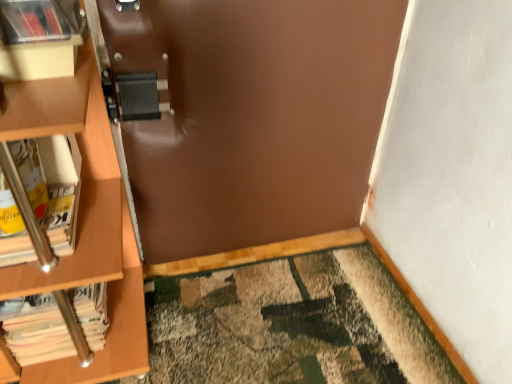
Find the location of a particular element. white paper book at left, the 2th book in the bottom-to-top sequence is located at coordinates point(52,185).

Find the location of `shelf lying on the right of white paper book at left, the 2th book in the bottom-to-top sequence`. shelf lying on the right of white paper book at left, the 2th book in the bottom-to-top sequence is located at coordinates (40, 38).

Based on the photo, in the image, is matte plastic shelf at upper left positioned in front of or behind white paper book at left, the 2th book in the bottom-to-top sequence?

Visually, matte plastic shelf at upper left is located in front of white paper book at left, the 2th book in the bottom-to-top sequence.

From a real-world perspective, which object rests below the other?

white paper book at left, the 2th book in the bottom-to-top sequence, is physically lower.

Would you say matte plastic shelf at upper left is to the left or to the right of white paper book at left, the 2th book in the bottom-to-top sequence, in the picture?

matte plastic shelf at upper left is to the right of white paper book at left, the 2th book in the bottom-to-top sequence.

From the picture: Can we say matte plastic shelf at upper left lies outside matte plastic book at upper left, the 3th book when ordered from bottom to top?

Yes, matte plastic shelf at upper left is located beyond the bounds of matte plastic book at upper left, the 3th book when ordered from bottom to top.

Based on the photo, considering the positions of objects matte plastic shelf at upper left and matte plastic book at upper left, which ranks as the 1th book in top-to-bottom order, in the image provided, who is more to the left, matte plastic shelf at upper left or matte plastic book at upper left, which ranks as the 1th book in top-to-bottom order,?

Positioned to the left is matte plastic shelf at upper left.

From a real-world perspective, is matte plastic shelf at upper left above or below matte plastic book at upper left, the 3th book when ordered from bottom to top?

matte plastic shelf at upper left is below matte plastic book at upper left, the 3th book when ordered from bottom to top.

How much distance is there between matte plastic shelf at upper left and matte plastic book at upper left, which ranks as the 1th book in top-to-bottom order?

A distance of 0.64 inches exists between matte plastic shelf at upper left and matte plastic book at upper left, which ranks as the 1th book in top-to-bottom order.

From the image's perspective, which is above, white paper book at left, the 3th book in the top-to-bottom sequence, or matte plastic book at upper left, which ranks as the 1th book in top-to-bottom order?

matte plastic book at upper left, which ranks as the 1th book in top-to-bottom order.

Considering the relative sizes of white paper book at left, the 3th book in the top-to-bottom sequence, and matte plastic book at upper left, which ranks as the 1th book in top-to-bottom order, in the image provided, is white paper book at left, the 3th book in the top-to-bottom sequence, bigger than matte plastic book at upper left, which ranks as the 1th book in top-to-bottom order,?

Yes, white paper book at left, the 3th book in the top-to-bottom sequence, is bigger than matte plastic book at upper left, which ranks as the 1th book in top-to-bottom order.

Is white paper book at left, the 3th book in the top-to-bottom sequence, positioned far away from matte plastic book at upper left, the 3th book when ordered from bottom to top?

No, there isn't a large distance between white paper book at left, the 3th book in the top-to-bottom sequence, and matte plastic book at upper left, the 3th book when ordered from bottom to top.

Is matte plastic book at upper left, the 3th book when ordered from bottom to top, to the left of white paper book at left, the 2th book in the bottom-to-top sequence, from the viewer's perspective?

No, matte plastic book at upper left, the 3th book when ordered from bottom to top, is not to the left of white paper book at left, the 2th book in the bottom-to-top sequence.

Which of these two, matte plastic book at upper left, the 3th book when ordered from bottom to top, or white paper book at left, the 2th book in the top-to-bottom sequence, stands taller?

white paper book at left, the 2th book in the top-to-bottom sequence.

Considering the positions of points (48, 20) and (35, 175), is point (48, 20) farther from camera compared to point (35, 175)?

No.

From the image's perspective, between matte plastic book at upper left, the 3th book when ordered from bottom to top, and white paper book at left, the 2th book in the bottom-to-top sequence, who is located below?

From the image's view, white paper book at left, the 2th book in the bottom-to-top sequence, is below.

Locate an element on the screen. The height and width of the screenshot is (384, 512). the 2nd book behind when counting from the matte plastic book at upper left, which ranks as the 1th book in top-to-bottom order is located at coordinates (35, 329).

Can you confirm if matte plastic book at upper left, the 3th book when ordered from bottom to top, is shorter than white paper book at left, placed as the 1th book when sorted from bottom to top?

Indeed, matte plastic book at upper left, the 3th book when ordered from bottom to top, has a lesser height compared to white paper book at left, placed as the 1th book when sorted from bottom to top.

Which object is closer to the camera, matte plastic book at upper left, the 3th book when ordered from bottom to top, or white paper book at left, the 3th book in the top-to-bottom sequence?

matte plastic book at upper left, the 3th book when ordered from bottom to top, is closer to the camera.

Which of these two, white paper book at left, the 3th book in the top-to-bottom sequence, or white paper book at left, the 2th book in the bottom-to-top sequence, stands shorter?

With less height is white paper book at left, the 2th book in the bottom-to-top sequence.

Locate an element on the screen. the 1st book in front of the white paper book at left, the 3th book in the top-to-bottom sequence is located at coordinates (52, 185).

In the image, is white paper book at left, the 3th book in the top-to-bottom sequence, positioned in front of or behind white paper book at left, the 2th book in the top-to-bottom sequence?

Visually, white paper book at left, the 3th book in the top-to-bottom sequence, is located behind white paper book at left, the 2th book in the top-to-bottom sequence.

Between white paper book at left, the 3th book in the top-to-bottom sequence, and white paper book at left, the 2th book in the bottom-to-top sequence, which one has smaller width?

white paper book at left, the 3th book in the top-to-bottom sequence.

Is matte plastic book at upper left, which ranks as the 1th book in top-to-bottom order, with matte plastic shelf at upper left?

Yes, matte plastic book at upper left, which ranks as the 1th book in top-to-bottom order, is with matte plastic shelf at upper left.

Which object is further away from the camera taking this photo, matte plastic book at upper left, which ranks as the 1th book in top-to-bottom order, or matte plastic shelf at upper left?

matte plastic shelf at upper left is further away from the camera.

Could you tell me if matte plastic book at upper left, which ranks as the 1th book in top-to-bottom order, is facing matte plastic shelf at upper left?

No, matte plastic book at upper left, which ranks as the 1th book in top-to-bottom order, does not turn towards matte plastic shelf at upper left.

From the image's perspective, which one is positioned lower, matte plastic book at upper left, the 3th book when ordered from bottom to top, or matte plastic shelf at upper left?

matte plastic shelf at upper left, from the image's perspective.

From a real-world perspective, which book is the 1st one underneath the matte plastic shelf at upper left? Please provide its 2D coordinates.

[(52, 185)]

Identify the location of book that is on the right side of matte plastic shelf at upper left. (36, 21).

Consider the image. From the image, which object appears to be farther from white paper book at left, the 3th book in the top-to-bottom sequence, matte plastic book at upper left, the 3th book when ordered from bottom to top, or white paper book at left, the 2th book in the bottom-to-top sequence?

Based on the image, matte plastic book at upper left, the 3th book when ordered from bottom to top, appears to be further to white paper book at left, the 3th book in the top-to-bottom sequence.

Estimate the real-world distances between objects in this image. Which object is closer to matte plastic book at upper left, which ranks as the 1th book in top-to-bottom order, matte plastic shelf at upper left or white paper book at left, placed as the 1th book when sorted from bottom to top?

matte plastic shelf at upper left is positioned closer to the anchor matte plastic book at upper left, which ranks as the 1th book in top-to-bottom order.

From the image, which object appears to be farther from white paper book at left, the 2th book in the bottom-to-top sequence, matte plastic shelf at upper left or matte plastic book at upper left, which ranks as the 1th book in top-to-bottom order?

matte plastic book at upper left, which ranks as the 1th book in top-to-bottom order, is positioned further to the anchor white paper book at left, the 2th book in the bottom-to-top sequence.

From the image, which object appears to be farther from white paper book at left, the 2th book in the top-to-bottom sequence, white paper book at left, the 3th book in the top-to-bottom sequence, or matte plastic shelf at upper left?

Among the two, white paper book at left, the 3th book in the top-to-bottom sequence, is located further to white paper book at left, the 2th book in the top-to-bottom sequence.

Based on their spatial positions, is white paper book at left, the 2th book in the top-to-bottom sequence, or white paper book at left, placed as the 1th book when sorted from bottom to top, further from matte plastic shelf at upper left?

white paper book at left, placed as the 1th book when sorted from bottom to top.

Based on their spatial positions, is matte plastic shelf at upper left or white paper book at left, the 2th book in the top-to-bottom sequence, further from white paper book at left, the 3th book in the top-to-bottom sequence?

Based on the image, matte plastic shelf at upper left appears to be further to white paper book at left, the 3th book in the top-to-bottom sequence.

Looking at this image, when comparing their distances from white paper book at left, the 2th book in the top-to-bottom sequence, does matte plastic book at upper left, the 3th book when ordered from bottom to top, or white paper book at left, the 3th book in the top-to-bottom sequence, seem further?

The object further to white paper book at left, the 2th book in the top-to-bottom sequence, is matte plastic book at upper left, the 3th book when ordered from bottom to top.

Looking at the image, which one is located further to matte plastic shelf at upper left, white paper book at left, the 3th book in the top-to-bottom sequence, or matte plastic book at upper left, the 3th book when ordered from bottom to top?

white paper book at left, the 3th book in the top-to-bottom sequence.

Locate an element on the screen. This screenshot has width=512, height=384. shelf between matte plastic book at upper left, which ranks as the 1th book in top-to-bottom order, and white paper book at left, the 3th book in the top-to-bottom sequence, in the vertical direction is located at coordinates (40, 38).

This screenshot has height=384, width=512. In order to click on shelf between matte plastic book at upper left, which ranks as the 1th book in top-to-bottom order, and white paper book at left, the 2th book in the bottom-to-top sequence, vertically in this screenshot , I will do `click(40, 38)`.

The height and width of the screenshot is (384, 512). What are the coordinates of `book between matte plastic shelf at upper left and white paper book at left, placed as the 1th book when sorted from bottom to top, vertically` in the screenshot? It's located at (52, 185).

The width and height of the screenshot is (512, 384). What are the coordinates of `book between matte plastic book at upper left, which ranks as the 1th book in top-to-bottom order, and white paper book at left, the 3th book in the top-to-bottom sequence, from top to bottom` in the screenshot? It's located at (52, 185).